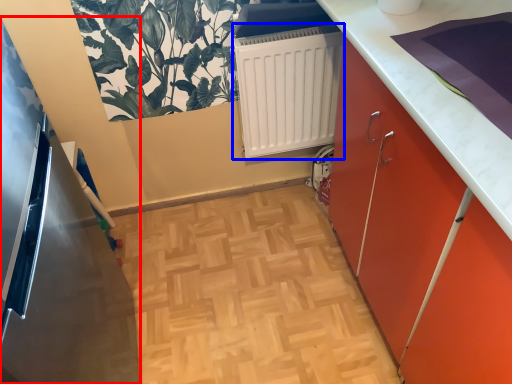
Question: Which object appears closest to the camera in this image, appliance (highlighted by a red box) or radiator (highlighted by a blue box)?

Choices:
 (A) appliance
 (B) radiator

Answer: (A)